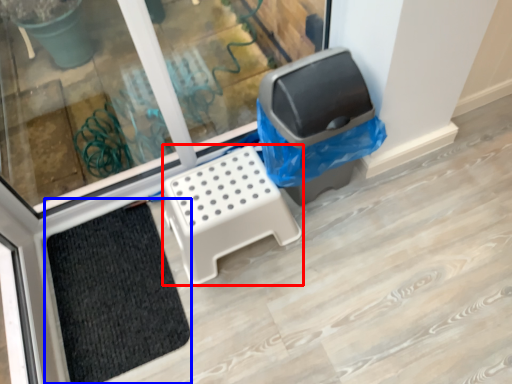
Question: Which object is closer to the camera taking this photo, furniture (highlighted by a red box) or doormat (highlighted by a blue box)?

Choices:
 (A) furniture
 (B) doormat

Answer: (A)